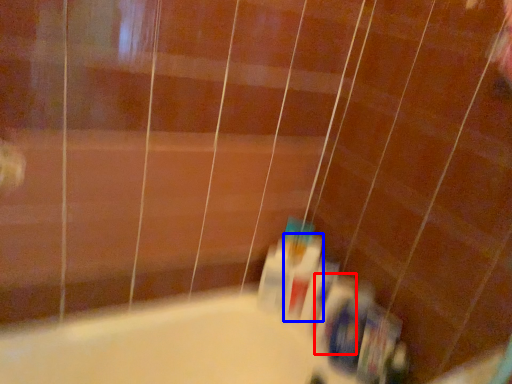
Question: Among these objects, which one is nearest to the camera, toiletry (highlighted by a red box) or mouthwash (highlighted by a blue box)?

Choices:
 (A) toiletry
 (B) mouthwash

Answer: (A)